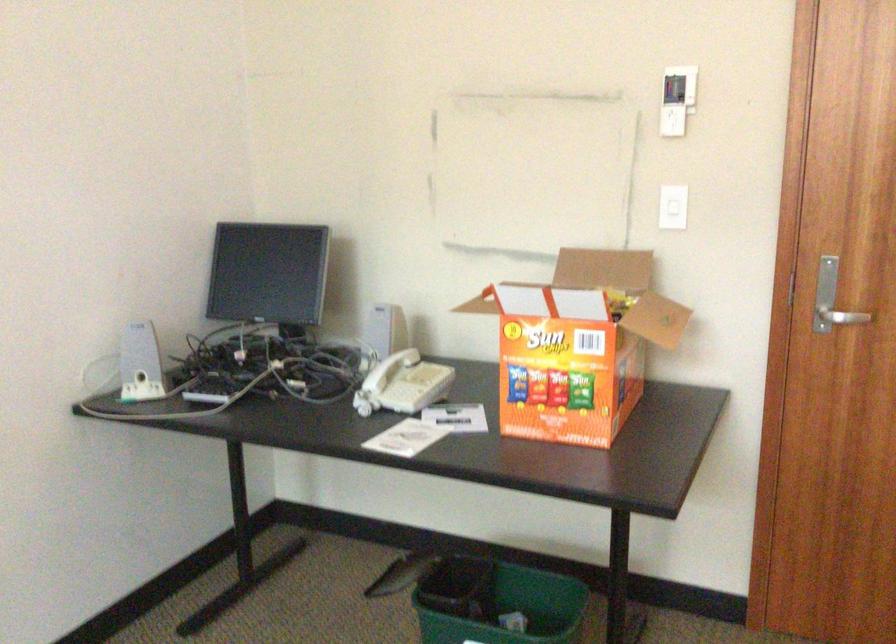
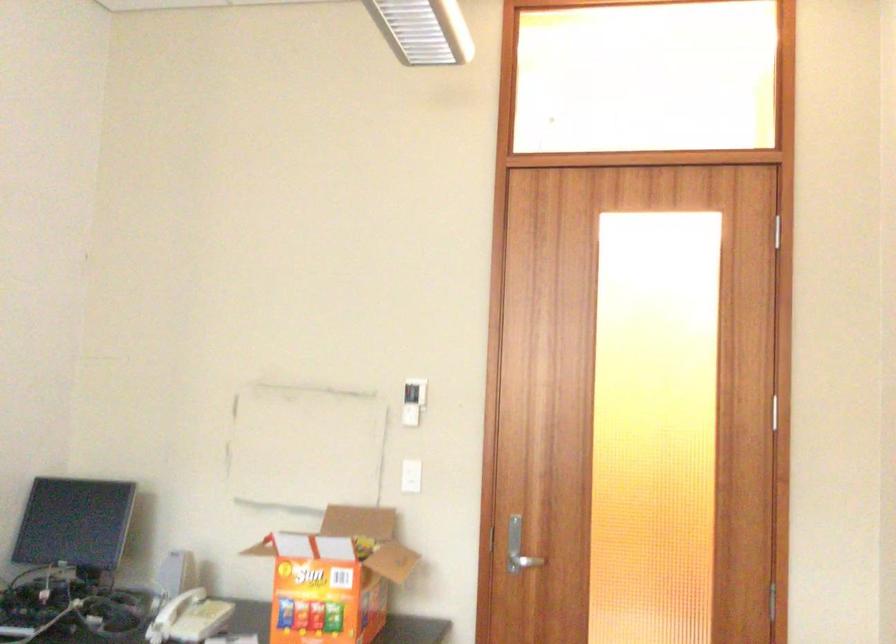
How did the camera likely rotate?

The camera's rotation is toward right-up.